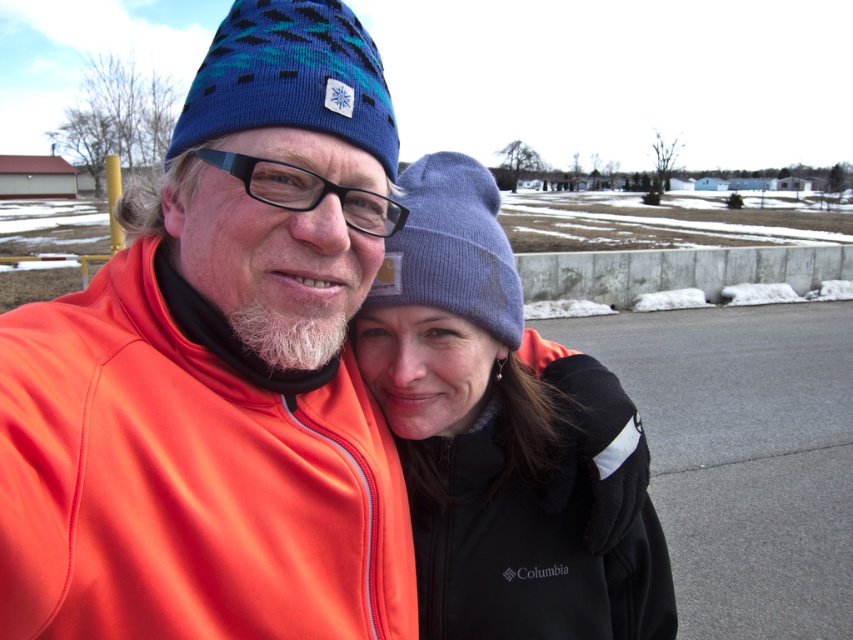
You are a photographer trying to capture a photo of both the black fleece jacket at center and the lavender knit beanie at center in the same frame. Your camera has a minimum focus distance of 5 inches. Can you take the photo without moving either object?

The distance between the black fleece jacket at center and the lavender knit beanie at center is 5.15 inches, which is greater than the camera minimum focus distance of 5 inches. Therefore, you can take the photo without moving either object.

You are a fashion designer observing two beanies in the image. The blue knitted beanie at upper center and the lavender knit beanie at center. Which one is bigger?

The blue knitted beanie at upper center has a larger size compared to the lavender knit beanie at center.